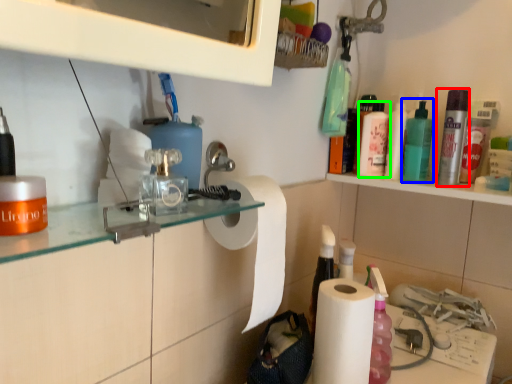
Question: Which object is the closest to the mouthwash (highlighted by a red box)? Choose among these: mouthwash (highlighted by a blue box) or mouthwash (highlighted by a green box).

Choices:
 (A) mouthwash
 (B) mouthwash

Answer: (A)